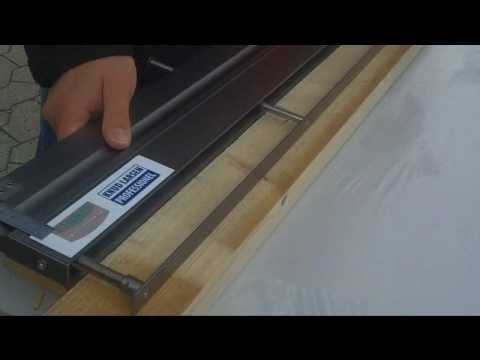
Where is `white table`? This screenshot has width=480, height=360. white table is located at coordinates (443, 288).